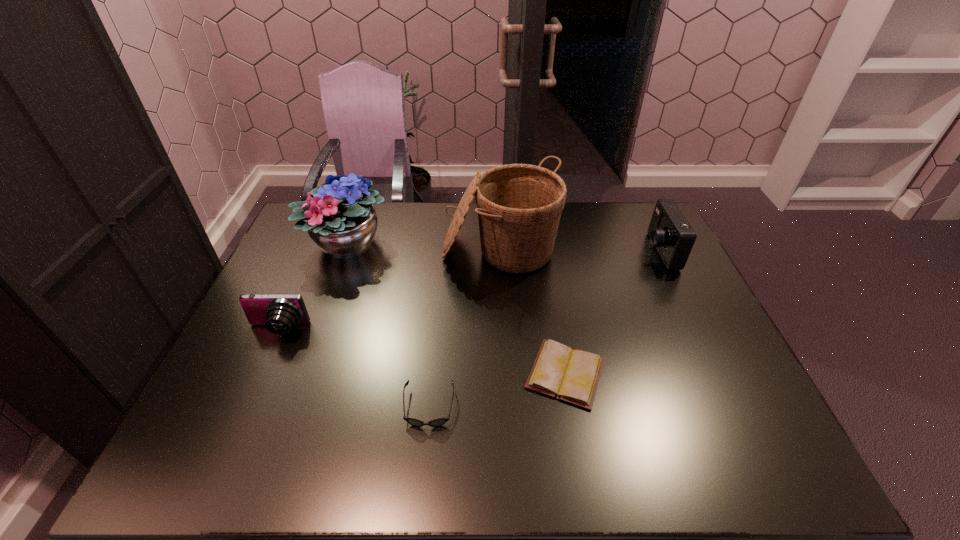
Image resolution: width=960 pixels, height=540 pixels. I want to click on camera at the left edge, so click(279, 313).

Identify the location of object that is at the right edge. (669, 231).

You are a GUI agent. You are given a task and a screenshot of the screen. Output one action in this format:
    pyautogui.click(x=<x>, y=<y>)
    Task: Click on the object located at the far left corner
    
    Given the screenshot: What is the action you would take?
    pyautogui.click(x=339, y=221)

Find the location of a particular element. object present at the far right corner is located at coordinates (669, 231).

What are the coordinates of `free spot at the near edge of the desktop` in the screenshot? It's located at (578, 440).

You are a GUI agent. You are given a task and a screenshot of the screen. Output one action in this format:
    pyautogui.click(x=<x>, y=<y>)
    Task: Click on the vacant space at the left edge of the desktop
    The image size is (960, 540).
    Given the screenshot: What is the action you would take?
    pyautogui.click(x=249, y=343)

Identify the location of vacant area at the right edge of the desktop. This screenshot has height=540, width=960. (655, 295).

Locate an element on the screen. free region at the near left corner is located at coordinates (178, 448).

The width and height of the screenshot is (960, 540). In the image, there is a desktop. What are the coordinates of `vacant space at the far right corner` in the screenshot? It's located at (633, 215).

Identify the location of free space at the near right corner of the desktop. The width and height of the screenshot is (960, 540). (715, 462).